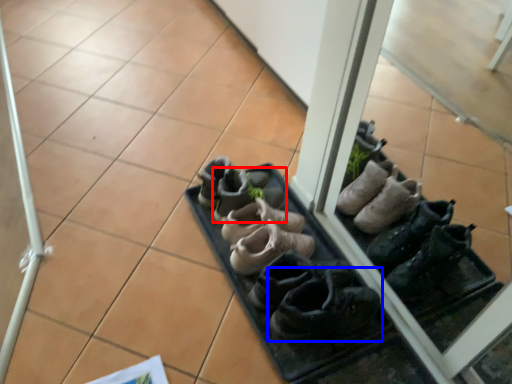
Question: Which point is closer to the camera, footwear (highlighted by a red box) or footwear (highlighted by a blue box)?

Choices:
 (A) footwear
 (B) footwear

Answer: (B)